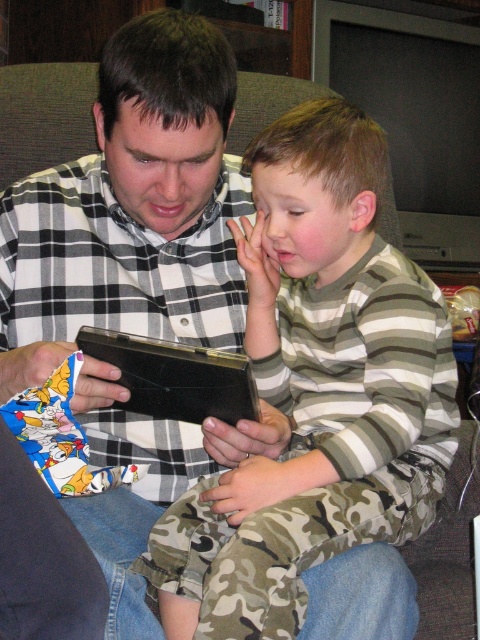
Is striped cotton shirt at center to the left of plaid shirt at center from the viewer's perspective?

In fact, striped cotton shirt at center is to the right of plaid shirt at center.

The image size is (480, 640). Find the location of `striped cotton shirt at center`. striped cotton shirt at center is located at coordinates coord(315,390).

Where is `striped cotton shirt at center`? Image resolution: width=480 pixels, height=640 pixels. striped cotton shirt at center is located at coordinates (315, 390).

Who is positioned more to the right, plaid shirt at center or black leather tablet at center?

black leather tablet at center is more to the right.

Between plaid shirt at center and black leather tablet at center, which one is positioned lower?

black leather tablet at center is below.

Who is more forward, (140, 604) or (230, 410)?

Positioned in front is point (140, 604).

The height and width of the screenshot is (640, 480). I want to click on plaid shirt at center, so 134,204.

Which is more to the left, striped cotton shirt at center or black leather tablet at center?

black leather tablet at center is more to the left.

Can you confirm if striped cotton shirt at center is thinner than black leather tablet at center?

No, striped cotton shirt at center is not thinner than black leather tablet at center.

Between point (423, 428) and point (165, 372), which one is positioned behind?

The point (423, 428) is more distant.

Locate an element on the screen. The height and width of the screenshot is (640, 480). striped cotton shirt at center is located at coordinates (315, 390).